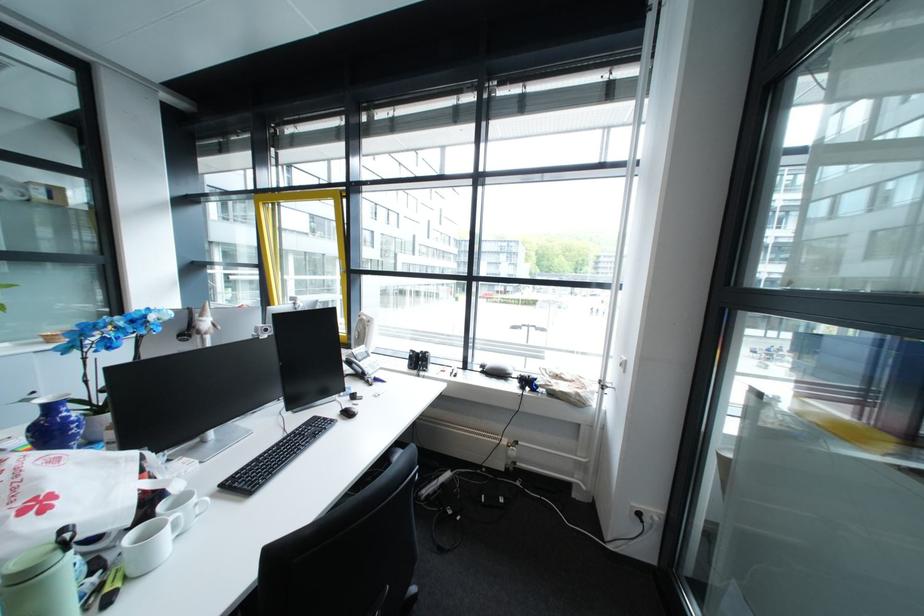
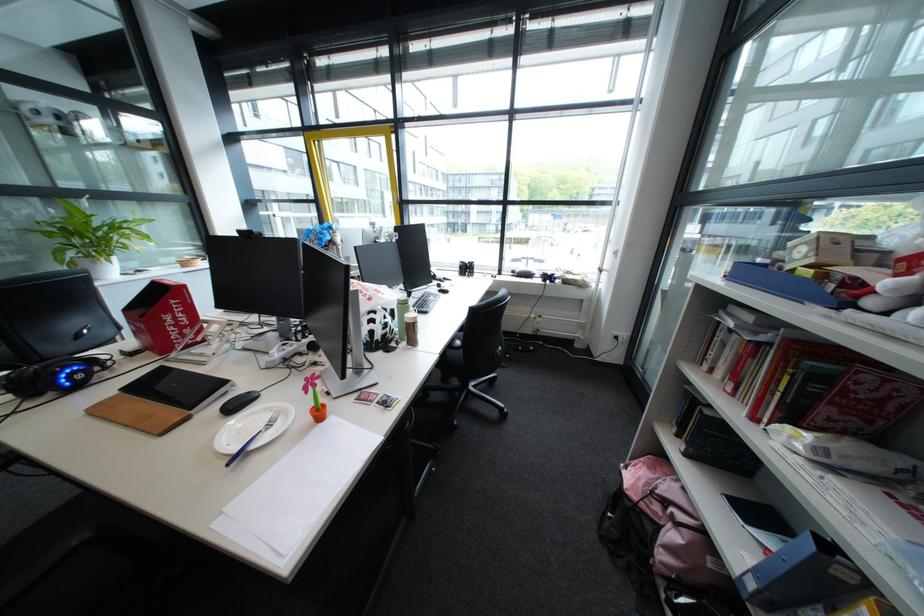
Which direction would the cameraman need to move to produce the second image?

The cameraman walked toward left, backward.